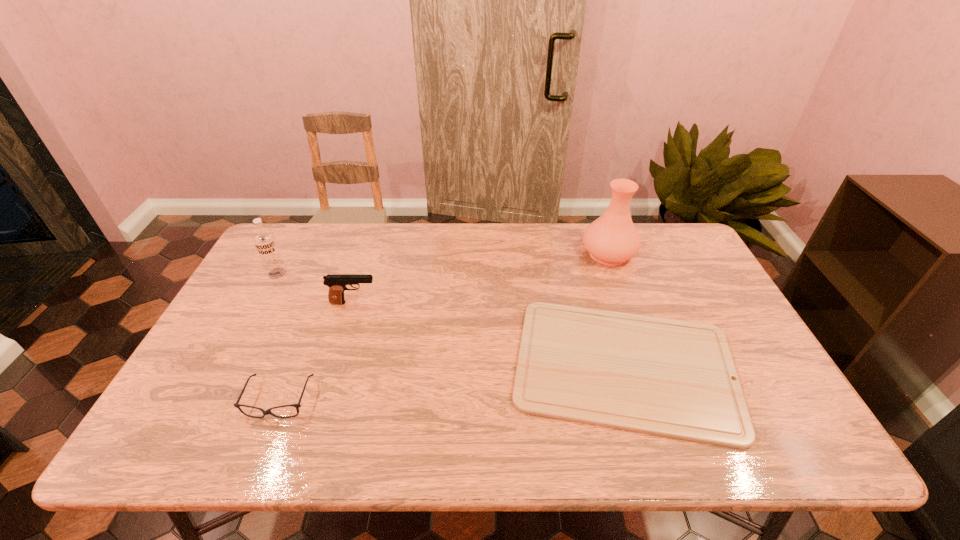
In order to click on vacant area situated on the left of the chopping board in this screenshot , I will do `click(391, 366)`.

The height and width of the screenshot is (540, 960). In order to click on object that is at the far edge in this screenshot , I will do `click(612, 239)`.

At what (x,y) coordinates should I click in order to perform the action: click on spectacles at the near edge. Please return your answer as a coordinate pair (x, y). Looking at the image, I should click on (268, 411).

What are the coordinates of `chopping board present at the near edge` in the screenshot? It's located at (674, 378).

At what (x,y) coordinates should I click in order to perform the action: click on object present at the left edge. Please return your answer as a coordinate pair (x, y). The image size is (960, 540). Looking at the image, I should click on (264, 240).

At what (x,y) coordinates should I click in order to perform the action: click on object located in the right edge section of the desktop. Please return your answer as a coordinate pair (x, y). Looking at the image, I should click on (674, 378).

This screenshot has width=960, height=540. Identify the location of object located at the near right corner. (674, 378).

The image size is (960, 540). Identify the location of vacant area at the far edge. (537, 244).

What are the coordinates of `vacant space at the near edge of the desktop` in the screenshot? It's located at (379, 440).

Locate an element on the screen. This screenshot has height=540, width=960. free region at the left edge of the desktop is located at coordinates (220, 373).